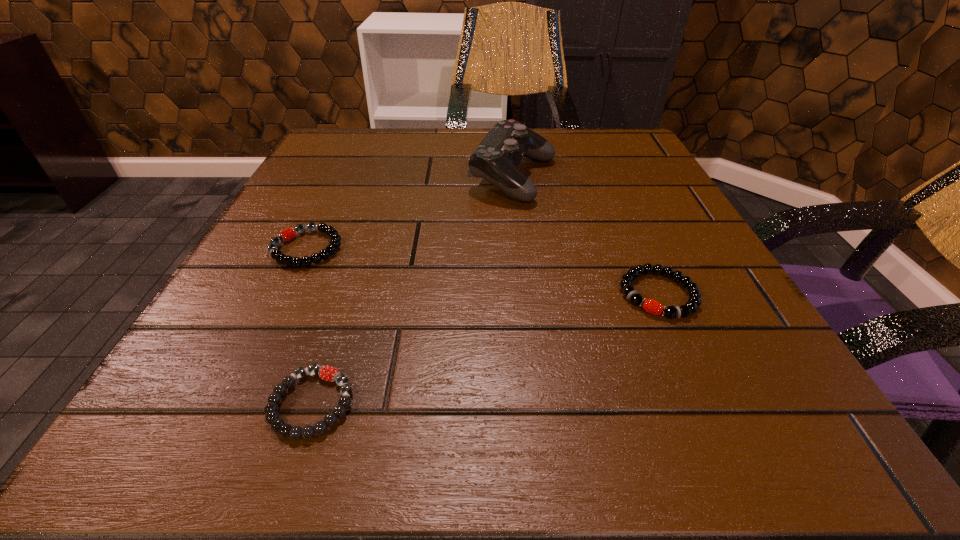
Locate an element on the screen. empty space that is in between the rightmost object and the third object from left to right is located at coordinates (586, 237).

Where is `the closest object to the shortest bracelet`? the closest object to the shortest bracelet is located at coordinates (287, 234).

Select which object appears as the third closest to the farthest object. Please provide its 2D coordinates. Your answer should be formatted as a tuple, i.e. [(x, y)], where the tuple contains the x and y coordinates of a point satisfying the conditions above.

[(328, 373)]

Select which bracelet is the closest to the rightmost object. Please provide its 2D coordinates. Your answer should be formatted as a tuple, i.e. [(x, y)], where the tuple contains the x and y coordinates of a point satisfying the conditions above.

[(328, 373)]

You are a GUI agent. You are given a task and a screenshot of the screen. Output one action in this format:
    pyautogui.click(x=<x>, y=<y>)
    Task: Click on the bracelet identified as the third closest to the second object from right to left
    The image size is (960, 540).
    Given the screenshot: What is the action you would take?
    pyautogui.click(x=328, y=373)

The height and width of the screenshot is (540, 960). In order to click on free space that satisfies the following two spatial constraints: 1. on the back side of the third object from left to right; 2. on the left side of the nearest object in this screenshot , I will do `click(386, 178)`.